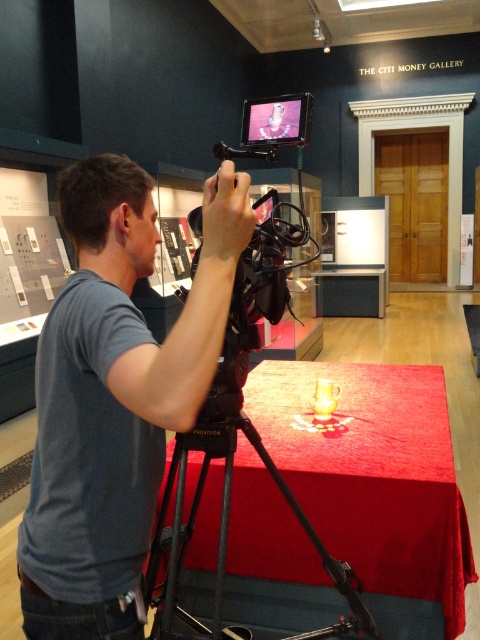
You are a photographer standing in The Citi Money Gallery. You notice a blue cotton shirt at center and a shiny red fabric at center. Which object is positioned to the left?

The blue cotton shirt at center is positioned to the left of the shiny red fabric at center.

You are a photographer positioned in front of the camera setup. You notice both the blue cotton shirt at center and the shiny red fabric at center in your viewfinder. Which object is closer to you?

The blue cotton shirt at center is closer to the viewer than the shiny red fabric at center.

You are standing in the Citi Money Gallery and want to locate the blue cotton shirt at center. According to the coordinates provided, where should you look?

The blue cotton shirt at center is located at point (116, 396).